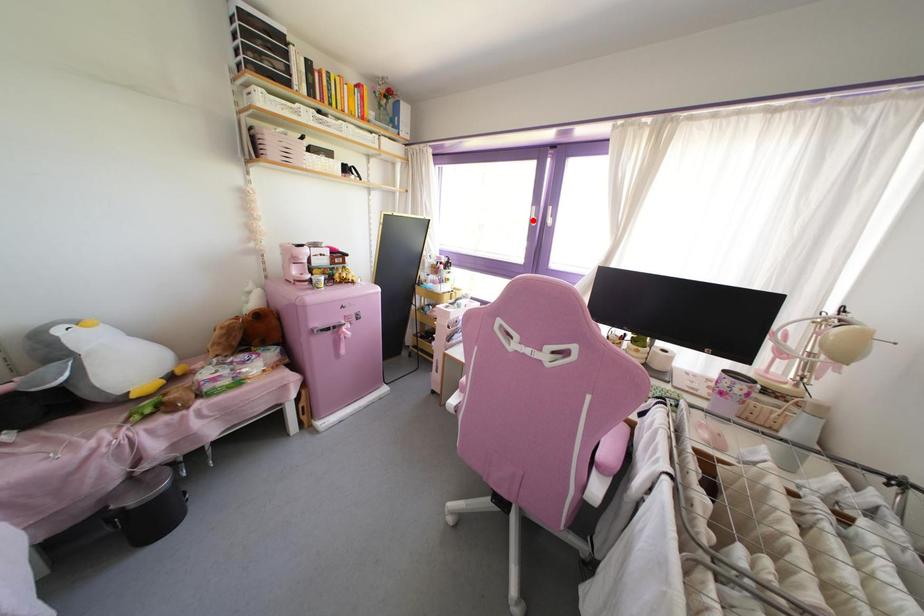
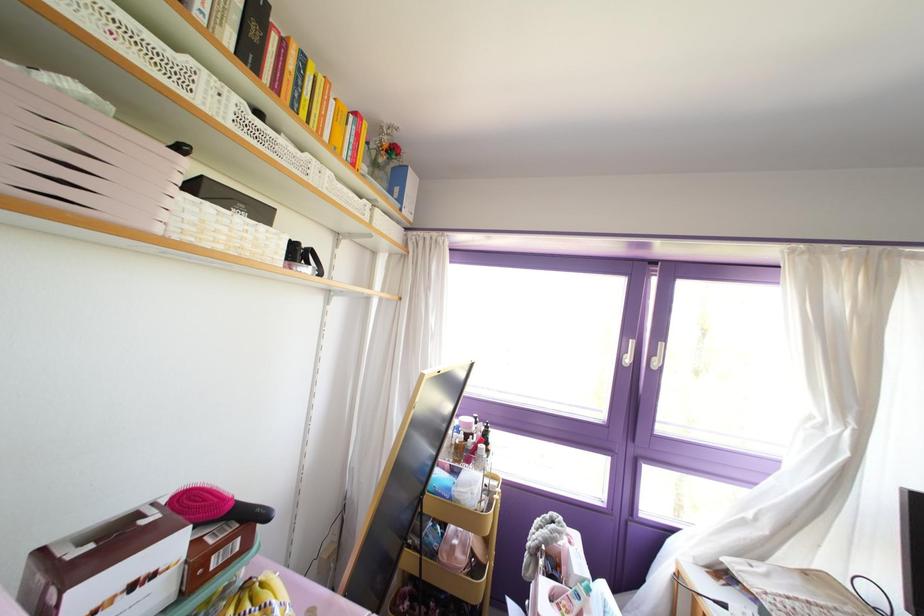
Question: A red point is marked in image1. In image2, is the corresponding 3D point closer to the camera or farther? Reply with the corresponding letter.

Choices:
 (A) The corresponding 3D point is closer.
 (B) The corresponding 3D point is farther.

Answer: (B)